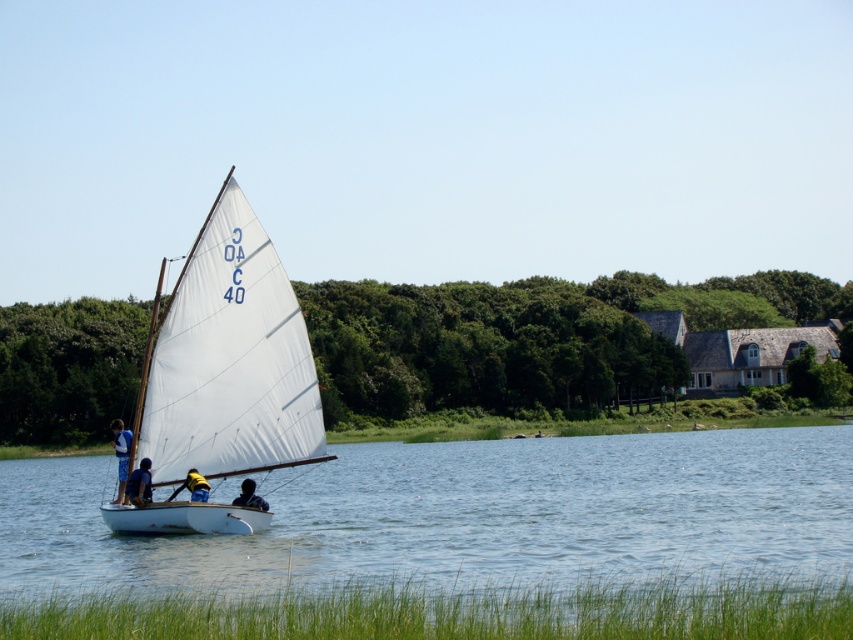
How far apart are white matte sailboat at center and yellow fabric at center?

white matte sailboat at center and yellow fabric at center are 1.25 meters apart from each other.

Is white matte sailboat at center wider than yellow fabric at center?

Correct, the width of white matte sailboat at center exceeds that of yellow fabric at center.

At what (x,y) coordinates should I click in order to perform the action: click on white matte sailboat at center. Please return your answer as a coordinate pair (x, y). The image size is (853, 640). Looking at the image, I should click on (229, 360).

Does white matte sailboat at center appear on the left side of dark blue fabric shirt at lower center?

Yes, white matte sailboat at center is to the left of dark blue fabric shirt at lower center.

Does white matte sailboat at center appear over dark blue fabric shirt at lower center?

Correct, white matte sailboat at center is located above dark blue fabric shirt at lower center.

Describe the element at coordinates (229, 360) in the screenshot. I see `white matte sailboat at center` at that location.

Find the location of a particular element. The width and height of the screenshot is (853, 640). white matte sailboat at center is located at coordinates (229, 360).

Does blue fabric shirt at lower left appear under dark blue fabric shirt at lower center?

Actually, blue fabric shirt at lower left is above dark blue fabric shirt at lower center.

Can you confirm if blue fabric shirt at lower left is wider than dark blue fabric shirt at lower center?

No, blue fabric shirt at lower left is not wider than dark blue fabric shirt at lower center.

Between point (142, 496) and point (254, 493), which one is positioned behind?

The point (254, 493) is more distant.

I want to click on blue fabric shirt at lower left, so click(x=138, y=483).